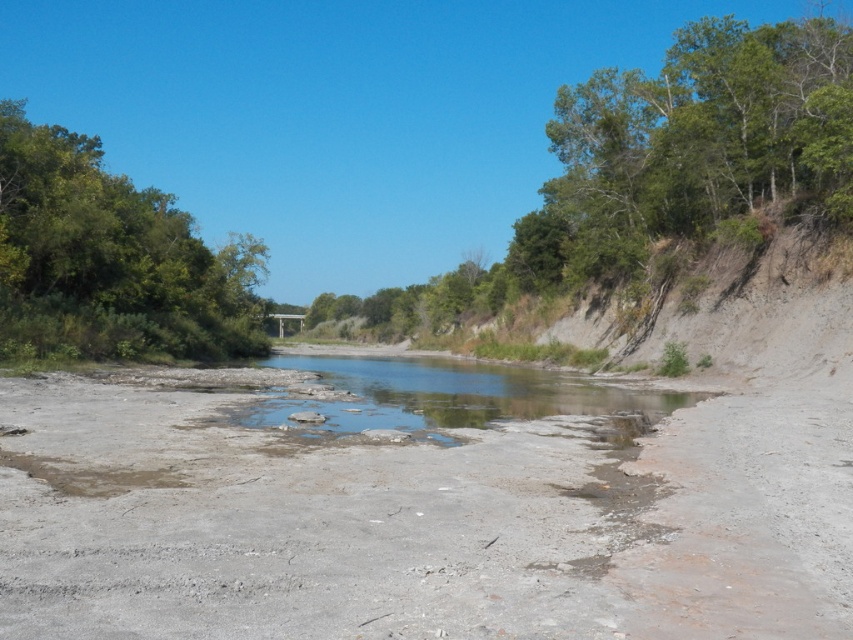
You are standing at the center of the riverbed and want to reach the green leafy tree at upper left. Which direction should you head towards?

You should head towards the upper left direction to reach the green leafy tree at upper left, as it is located at point coordinates of (109, 260).

Based on the photo, you are a hiker trying to cross the river at the point marked by point [660,170]. The point is near green leafy trees at upper right. Is the area around this point suitable for crossing?

The point [660,170] is marked near green leafy trees at upper right, which are on the left side of the river lined with dense leafy vegetation. Since the left side is described as dense and the right has a steep bank, the left side might offer a safer crossing with more stable ground compared to the steep, eroded right bank. However, the foreground has cracked earth suggesting dry conditions, so water levels might be low. Check for stable footing and shallow water before crossing.

You are a hiker trying to cross the river at the clear water at center. There is a green leafy trees at upper right nearby. Which direction should you head to reach the trees after crossing?

The green leafy trees at upper right are wider than the clear water at center, so after crossing the clear water at center, you should head towards the direction of the green leafy trees at upper right to reach them.